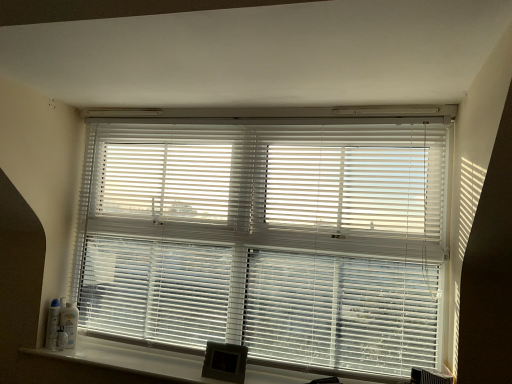
Question: In the image, is white smooth window sill at lower center positioned in front of or behind white plastic blinds at center?

Choices:
 (A) front
 (B) behind

Answer: (A)

Question: Is white smooth window sill at lower center situated inside white plastic blinds at center or outside?

Choices:
 (A) inside
 (B) outside

Answer: (B)

Question: Considering the relative positions of white smooth window sill at lower center and white plastic blinds at center in the image provided, is white smooth window sill at lower center to the left or to the right of white plastic blinds at center?

Choices:
 (A) left
 (B) right

Answer: (A)

Question: Considering the positions of white plastic blinds at center and white smooth window sill at lower center in the image, is white plastic blinds at center taller or shorter than white smooth window sill at lower center?

Choices:
 (A) tall
 (B) short

Answer: (A)

Question: In the image, is white plastic blinds at center positioned in front of or behind white smooth window sill at lower center?

Choices:
 (A) behind
 (B) front

Answer: (A)

Question: Would you say white plastic blinds at center is to the left or to the right of white smooth window sill at lower center in the picture?

Choices:
 (A) right
 (B) left

Answer: (A)

Question: Looking at their shapes, would you say white plastic blinds at center is wider or thinner than white smooth window sill at lower center?

Choices:
 (A) thin
 (B) wide

Answer: (A)